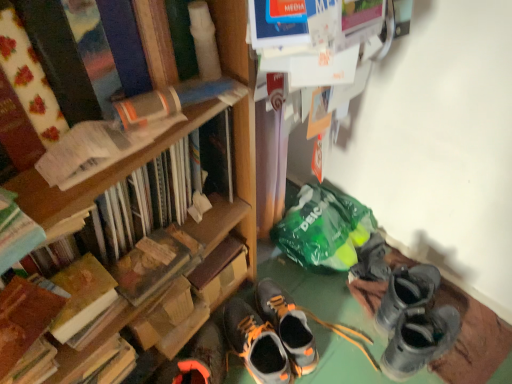
What do you see at coordinates (204, 359) in the screenshot? I see `orange suede sneaker at lower center, the first footwear positioned from the left` at bounding box center [204, 359].

Find the location of a particular element. This screenshot has height=384, width=512. gray suede sneakers at center, marked as the first footwear in a right-to-left arrangement is located at coordinates (300, 327).

This screenshot has height=384, width=512. I want to click on hardcover book at left, marked as the first book in a bottom-to-top arrangement, so click(24, 319).

Locate an element on the screen. hardcover book at center is located at coordinates (152, 263).

Identify the location of orange suede sneaker at lower center, which is the third footwear in right-to-left order. The height and width of the screenshot is (384, 512). (204, 359).

Is orange and black leather shoes at center, which is the 2th footwear in right-to-left order, far from orange suede sneaker at lower center, which is the third footwear in right-to-left order?

No, orange and black leather shoes at center, which is the 2th footwear in right-to-left order, is not far from orange suede sneaker at lower center, which is the third footwear in right-to-left order.

Considering the relative positions of orange and black leather shoes at center, which is the 2th footwear in right-to-left order, and orange suede sneaker at lower center, which is the third footwear in right-to-left order, in the image provided, is orange and black leather shoes at center, which is the 2th footwear in right-to-left order, in front of orange suede sneaker at lower center, which is the third footwear in right-to-left order,?

No, it is behind orange suede sneaker at lower center, which is the third footwear in right-to-left order.

Considering the relative sizes of orange and black leather shoes at center, which is the 2th footwear in right-to-left order, and orange suede sneaker at lower center, which is the third footwear in right-to-left order, in the image provided, is orange and black leather shoes at center, which is the 2th footwear in right-to-left order, bigger than orange suede sneaker at lower center, which is the third footwear in right-to-left order,?

Incorrect, orange and black leather shoes at center, which is the 2th footwear in right-to-left order, is not larger than orange suede sneaker at lower center, which is the third footwear in right-to-left order.

Is hardcover book at left, which is counted as the fourth book, starting from the top, far away from hardcover book at left, marked as the 3th book in a top-to-bottom arrangement?

That's not correct — hardcover book at left, which is counted as the fourth book, starting from the top, is a little close to hardcover book at left, marked as the 3th book in a top-to-bottom arrangement.

Is hardcover book at left, positioned as the second book in bottom-to-top order, positioned before hardcover book at left, marked as the 3th book in a top-to-bottom arrangement?

No, hardcover book at left, positioned as the second book in bottom-to-top order, is further to the viewer.

Which of these two, hardcover book at left, positioned as the second book in bottom-to-top order, or hardcover book at left, which appears as the third book when ordered from the bottom, stands taller?

hardcover book at left, positioned as the second book in bottom-to-top order, is taller.

At what (x,y) coordinates should I click in order to perform the action: click on book that is the 3rd object located in front of the hardcover book at left, positioned as the second book in bottom-to-top order. Please return your answer as a coordinate pair (x, y). This screenshot has width=512, height=384. Looking at the image, I should click on (16, 232).

Is hardcover book at left, which is counted as the fourth book, starting from the top, shorter than orange and black leather shoes at center, the second footwear in the left-to-right sequence?

Correct, hardcover book at left, which is counted as the fourth book, starting from the top, is not as tall as orange and black leather shoes at center, the second footwear in the left-to-right sequence.

From a real-world perspective, is hardcover book at left, which is counted as the fourth book, starting from the top, on orange and black leather shoes at center, the second footwear in the left-to-right sequence?

Yes, from a real-world perspective, hardcover book at left, which is counted as the fourth book, starting from the top, is on top of orange and black leather shoes at center, the second footwear in the left-to-right sequence.

Does hardcover book at left, which is counted as the fourth book, starting from the top, contain orange and black leather shoes at center, which is the 2th footwear in right-to-left order?

That's incorrect, orange and black leather shoes at center, which is the 2th footwear in right-to-left order, is not inside hardcover book at left, which is counted as the fourth book, starting from the top.

Is point (103, 284) farther from camera compared to point (236, 315)?

No, it is not.

Based on the photo, is hardcover book at left, which is the 1th book in top-to-bottom order, positioned far away from hardcover book at center?

That's not correct — hardcover book at left, which is the 1th book in top-to-bottom order, is a little close to hardcover book at center.

From a real-world perspective, is hardcover book at left, the fifth book positioned from the bottom, beneath hardcover book at center?

Actually, hardcover book at left, the fifth book positioned from the bottom, is physically above hardcover book at center in the real world.

Does point (25, 5) come in front of point (154, 288)?

Yes, point (25, 5) is closer to viewer.

Which object is more forward, hardcover book at left, which is the 1th book in top-to-bottom order, or hardcover book at center?

Positioned in front is hardcover book at left, which is the 1th book in top-to-bottom order.

Is hardcover book at left, the fifth book positioned from the bottom, not inside hardcover book at left, which is the fifth book in top-to-bottom order?

Yes.

Are hardcover book at left, the fifth book positioned from the bottom, and hardcover book at left, marked as the first book in a bottom-to-top arrangement, located far from each other?

No, hardcover book at left, the fifth book positioned from the bottom, is not far from hardcover book at left, marked as the first book in a bottom-to-top arrangement.

Considering the sizes of hardcover book at left, the fifth book positioned from the bottom, and hardcover book at left, marked as the first book in a bottom-to-top arrangement, in the image, is hardcover book at left, the fifth book positioned from the bottom, bigger or smaller than hardcover book at left, marked as the first book in a bottom-to-top arrangement,?

Considering their sizes, hardcover book at left, the fifth book positioned from the bottom, takes up more space than hardcover book at left, marked as the first book in a bottom-to-top arrangement.

In terms of height, does hardcover book at left, marked as the 3th book in a top-to-bottom arrangement, look taller or shorter compared to hardcover book at center?

hardcover book at left, marked as the 3th book in a top-to-bottom arrangement, is shorter than hardcover book at center.

Considering the relative positions of hardcover book at left, marked as the 3th book in a top-to-bottom arrangement, and hardcover book at center in the image provided, is hardcover book at left, marked as the 3th book in a top-to-bottom arrangement, to the right of hardcover book at center from the viewer's perspective?

No, hardcover book at left, marked as the 3th book in a top-to-bottom arrangement, is not to the right of hardcover book at center.

Is hardcover book at left, marked as the 3th book in a top-to-bottom arrangement, turned away from hardcover book at center?

hardcover book at left, marked as the 3th book in a top-to-bottom arrangement, does not have its back to hardcover book at center.

How different are the orientations of hardcover book at left, which appears as the third book when ordered from the bottom, and hardcover book at center in degrees?

0.000294 degrees separate the facing orientations of hardcover book at left, which appears as the third book when ordered from the bottom, and hardcover book at center.

Is gray suede sneakers at center, which is the third footwear in left-to-right order, surrounding hardcover book at left, which is counted as the fourth book, starting from the top?

No, hardcover book at left, which is counted as the fourth book, starting from the top, is not surrounded by gray suede sneakers at center, which is the third footwear in left-to-right order.

Where is `the 3rd footwear behind the hardcover book at left, which is counted as the fourth book, starting from the top, counting from the anchor's position`? The width and height of the screenshot is (512, 384). the 3rd footwear behind the hardcover book at left, which is counted as the fourth book, starting from the top, counting from the anchor's position is located at coordinates (300, 327).

Which is more to the right, gray suede sneakers at center, marked as the first footwear in a right-to-left arrangement, or hardcover book at left, which is counted as the fourth book, starting from the top?

Positioned to the right is gray suede sneakers at center, marked as the first footwear in a right-to-left arrangement.

From a real-world perspective, which footwear is the 1st one underneath the orange suede sneaker at lower center, the first footwear positioned from the left? Please provide its 2D coordinates.

[(256, 344)]

Which book is the 3rd one when counting from the back of the hardcover book at left, marked as the 3th book in a top-to-bottom arrangement? Please provide its 2D coordinates.

[(82, 296)]

When comparing their distances from orange suede sneaker at lower center, which is the third footwear in right-to-left order, does hardcover book at left, which is the fifth book in top-to-bottom order, or hardcover book at left, positioned as the second book in bottom-to-top order, seem closer?

The object closer to orange suede sneaker at lower center, which is the third footwear in right-to-left order, is hardcover book at left, positioned as the second book in bottom-to-top order.

Which object lies further to the anchor point hardcover book at left, positioned as the second book in bottom-to-top order, hardcover book at left, marked as the 4th book in a bottom-to-top arrangement, or orange suede sneaker at lower center, the first footwear positioned from the left?

Among the two, orange suede sneaker at lower center, the first footwear positioned from the left, is located further to hardcover book at left, positioned as the second book in bottom-to-top order.

Which object lies further to the anchor point hardcover book at left, which is counted as the fourth book, starting from the top, hardcover book at left, marked as the first book in a bottom-to-top arrangement, or hardcover book at center?

hardcover book at center lies further to hardcover book at left, which is counted as the fourth book, starting from the top, than the other object.

Considering their positions, is orange suede sneaker at lower center, the first footwear positioned from the left, positioned closer to gray suede sneakers at center, marked as the first footwear in a right-to-left arrangement, than hardcover book at center?

orange suede sneaker at lower center, the first footwear positioned from the left, lies closer to gray suede sneakers at center, marked as the first footwear in a right-to-left arrangement, than the other object.

When comparing their distances from hardcover book at left, marked as the 3th book in a top-to-bottom arrangement, does orange suede sneaker at lower center, which is the third footwear in right-to-left order, or hardcover book at left, which is the fifth book in top-to-bottom order, seem closer?

hardcover book at left, which is the fifth book in top-to-bottom order, lies closer to hardcover book at left, marked as the 3th book in a top-to-bottom arrangement, than the other object.

Estimate the real-world distances between objects in this image. Which object is closer to hardcover book at center, hardcover book at left, which is the fifth book in top-to-bottom order, or hardcover book at left, positioned as the second book in bottom-to-top order?

hardcover book at left, positioned as the second book in bottom-to-top order, is positioned closer to the anchor hardcover book at center.

When comparing their distances from gray suede sneakers at center, which is the third footwear in left-to-right order, does hardcover book at center or orange suede sneaker at lower center, the first footwear positioned from the left, seem closer?

Among the two, orange suede sneaker at lower center, the first footwear positioned from the left, is located nearer to gray suede sneakers at center, which is the third footwear in left-to-right order.

Consider the image. Looking at the image, which one is located further to orange suede sneaker at lower center, which is the third footwear in right-to-left order, hardcover book at left, which is the 1th book in top-to-bottom order, or hardcover book at left, marked as the first book in a bottom-to-top arrangement?

hardcover book at left, which is the 1th book in top-to-bottom order, lies further to orange suede sneaker at lower center, which is the third footwear in right-to-left order, than the other object.

What are the coordinates of `paperback book situated between hardcover book at left, which is counted as the fourth book, starting from the top, and gray suede sneakers at center, which is the third footwear in left-to-right order, from left to right` in the screenshot? It's located at (152, 263).

Identify the location of paperback book that lies between hardcover book at left, the fifth book positioned from the bottom, and hardcover book at left, which is the fifth book in top-to-bottom order, from top to bottom. (152, 263).

Where is `paperback book that lies between hardcover book at left, the fifth book positioned from the bottom, and orange and black leather shoes at center, the second footwear in the left-to-right sequence, from top to bottom`? The height and width of the screenshot is (384, 512). paperback book that lies between hardcover book at left, the fifth book positioned from the bottom, and orange and black leather shoes at center, the second footwear in the left-to-right sequence, from top to bottom is located at coordinates (152, 263).

Where is `paperback book between hardcover book at left, which is the fifth book in top-to-bottom order, and orange suede sneaker at lower center, which is the third footwear in right-to-left order, from left to right`? This screenshot has width=512, height=384. paperback book between hardcover book at left, which is the fifth book in top-to-bottom order, and orange suede sneaker at lower center, which is the third footwear in right-to-left order, from left to right is located at coordinates (152, 263).